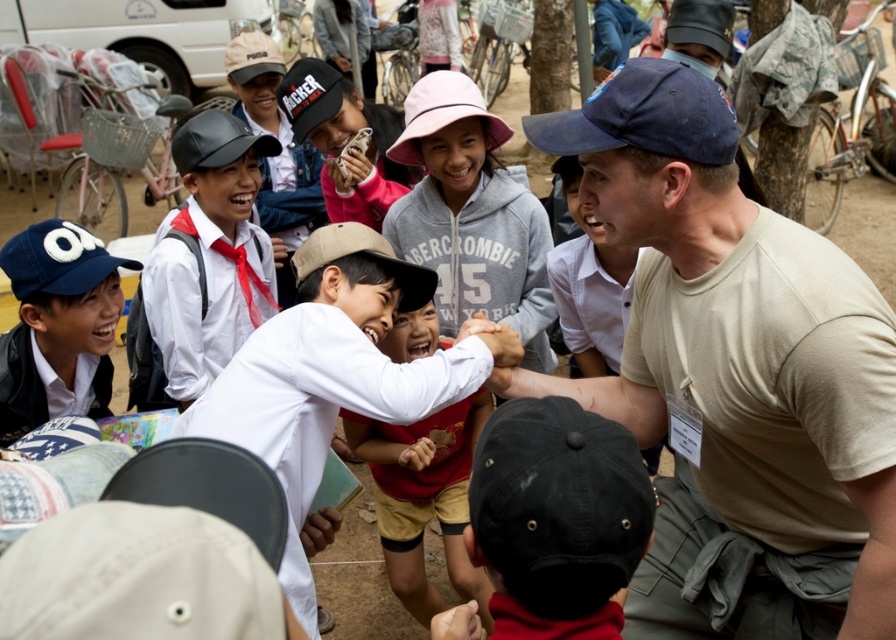
The width and height of the screenshot is (896, 640). What do you see at coordinates (560, 500) in the screenshot?
I see `black matte baseball cap at lower center` at bounding box center [560, 500].

Between point (553, 515) and point (448, 566), which one is positioned in front?

Point (553, 515) is in front.

Where is `black matte baseball cap at lower center`? This screenshot has height=640, width=896. black matte baseball cap at lower center is located at coordinates (560, 500).

In order to click on black matte baseball cap at lower center in this screenshot , I will do `click(560, 500)`.

Which is more to the left, blue fabric baseball cap at upper center or pink fabric baseball hat at upper center?

pink fabric baseball hat at upper center

Which is below, blue fabric baseball cap at upper center or pink fabric baseball hat at upper center?

blue fabric baseball cap at upper center is lower down.

The height and width of the screenshot is (640, 896). What are the coordinates of `blue fabric baseball cap at upper center` in the screenshot? It's located at (644, 115).

Does point (138, 262) come behind point (349, 236)?

Yes, it is.

Does white matte cap at left appear on the left side of tan fabric baseball cap at center?

Correct, you'll find white matte cap at left to the left of tan fabric baseball cap at center.

Does point (108, 387) come farther from viewer compared to point (309, 252)?

Yes, it is behind point (309, 252).

Where is `white matte cap at left`? Image resolution: width=896 pixels, height=640 pixels. white matte cap at left is located at coordinates (57, 326).